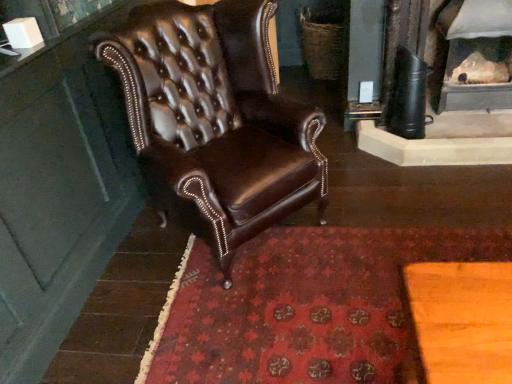
Question: From the image's perspective, does red carpet at center appear higher than brown leather chair at center?

Choices:
 (A) no
 (B) yes

Answer: (A)

Question: From a real-world perspective, is red carpet at center below brown leather chair at center?

Choices:
 (A) no
 (B) yes

Answer: (B)

Question: Considering the relative sizes of red carpet at center and brown leather chair at center in the image provided, is red carpet at center wider than brown leather chair at center?

Choices:
 (A) yes
 (B) no

Answer: (A)

Question: Can you confirm if red carpet at center is shorter than brown leather chair at center?

Choices:
 (A) no
 (B) yes

Answer: (B)

Question: Does red carpet at center have a larger size compared to brown leather chair at center?

Choices:
 (A) yes
 (B) no

Answer: (B)

Question: Looking at the image, does red carpet at center seem bigger or smaller compared to white textured fireplace at upper right?

Choices:
 (A) small
 (B) big

Answer: (A)

Question: Is red carpet at center spatially inside white textured fireplace at upper right, or outside of it?

Choices:
 (A) inside
 (B) outside

Answer: (B)

Question: Considering the relative positions of red carpet at center and white textured fireplace at upper right in the image provided, is red carpet at center to the left or to the right of white textured fireplace at upper right?

Choices:
 (A) left
 (B) right

Answer: (A)

Question: Considering the positions of point (159, 369) and point (507, 82), is point (159, 369) closer or farther from the camera than point (507, 82)?

Choices:
 (A) closer
 (B) farther

Answer: (A)

Question: In the image, is brown leather chair at center positioned in front of or behind red carpet at center?

Choices:
 (A) front
 (B) behind

Answer: (A)

Question: Is brown leather chair at center taller or shorter than red carpet at center?

Choices:
 (A) tall
 (B) short

Answer: (A)

Question: Considering the positions of point (289, 157) and point (415, 379), is point (289, 157) closer or farther from the camera than point (415, 379)?

Choices:
 (A) farther
 (B) closer

Answer: (A)

Question: From a real-world perspective, relative to red carpet at center, is brown leather chair at center vertically above or below?

Choices:
 (A) above
 (B) below

Answer: (A)

Question: From the image's perspective, is brown leather chair at center above or below white textured fireplace at upper right?

Choices:
 (A) above
 (B) below

Answer: (B)

Question: Looking at their shapes, would you say brown leather chair at center is wider or thinner than white textured fireplace at upper right?

Choices:
 (A) thin
 (B) wide

Answer: (B)